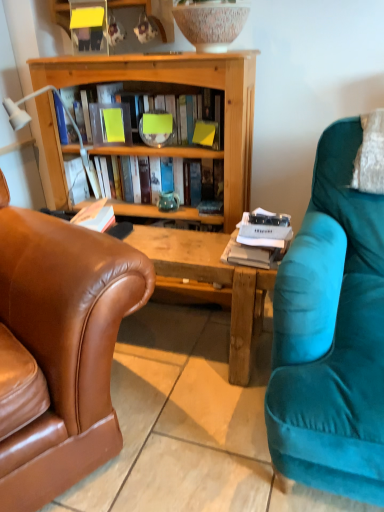
Question: Should I look upward or downward to see brown leather chair at left?

Choices:
 (A) up
 (B) down

Answer: (B)

Question: Is yellow paper at center positioned beyond the bounds of wooden book at center, acting as the 2th book starting from the top?

Choices:
 (A) no
 (B) yes

Answer: (B)

Question: From a real-world perspective, is yellow paper at center located beneath wooden book at center, which is the 1th book from bottom to top?

Choices:
 (A) yes
 (B) no

Answer: (B)

Question: Is yellow paper at center positioned before wooden book at center, acting as the 2th book starting from the top?

Choices:
 (A) yes
 (B) no

Answer: (B)

Question: Would you consider yellow paper at center to be distant from wooden book at center, which is the 1th book from bottom to top?

Choices:
 (A) no
 (B) yes

Answer: (A)

Question: Can you confirm if yellow paper at center is positioned to the left of wooden book at center, acting as the 2th book starting from the top?

Choices:
 (A) yes
 (B) no

Answer: (A)

Question: Is wooden book at center, acting as the 2th book starting from the top, located within yellow paper at center?

Choices:
 (A) no
 (B) yes

Answer: (A)

Question: Is yellow paper at center facing towards white plastic lamp at left?

Choices:
 (A) no
 (B) yes

Answer: (B)

Question: Is yellow paper at center behind white plastic lamp at left?

Choices:
 (A) yes
 (B) no

Answer: (A)

Question: Considering the relative positions of yellow paper at center and white plastic lamp at left in the image provided, is yellow paper at center to the right of white plastic lamp at left from the viewer's perspective?

Choices:
 (A) no
 (B) yes

Answer: (B)

Question: Considering the relative sizes of yellow paper at center and white plastic lamp at left in the image provided, is yellow paper at center thinner than white plastic lamp at left?

Choices:
 (A) no
 (B) yes

Answer: (B)

Question: Considering the relative positions of yellow paper at center and white plastic lamp at left in the image provided, is yellow paper at center to the left of white plastic lamp at left from the viewer's perspective?

Choices:
 (A) no
 (B) yes

Answer: (A)

Question: Considering the relative sizes of yellow paper at center and white plastic lamp at left in the image provided, is yellow paper at center smaller than white plastic lamp at left?

Choices:
 (A) no
 (B) yes

Answer: (B)

Question: Does yellow paper at center appear on the left side of teal ceramic vase at center?

Choices:
 (A) no
 (B) yes

Answer: (B)